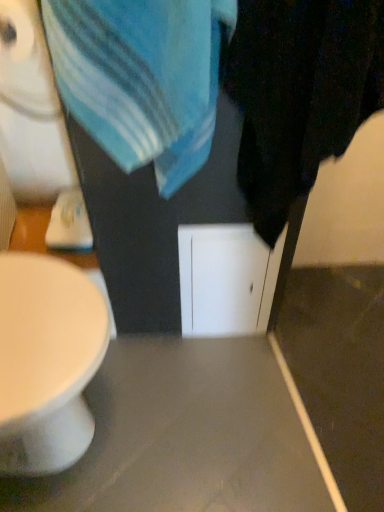
Question: Considering the relative sizes of white paper at upper left and matte gray table at center in the image provided, is white paper at upper left smaller than matte gray table at center?

Choices:
 (A) no
 (B) yes

Answer: (B)

Question: Is white paper at upper left completely or partially outside of matte gray table at center?

Choices:
 (A) yes
 (B) no

Answer: (A)

Question: Is white paper at upper left at the left side of matte gray table at center?

Choices:
 (A) yes
 (B) no

Answer: (A)

Question: Is matte gray table at center at the back of white paper at upper left?

Choices:
 (A) no
 (B) yes

Answer: (A)

Question: Considering the relative sizes of white paper at upper left and matte gray table at center in the image provided, is white paper at upper left shorter than matte gray table at center?

Choices:
 (A) no
 (B) yes

Answer: (A)

Question: From the image's perspective, relative to black matte towel at right, is matte gray table at center above or below?

Choices:
 (A) above
 (B) below

Answer: (B)

Question: Considering the positions of point (244, 344) and point (264, 150), is point (244, 344) closer or farther from the camera than point (264, 150)?

Choices:
 (A) closer
 (B) farther

Answer: (B)

Question: Is matte gray table at center situated inside black matte towel at right or outside?

Choices:
 (A) outside
 (B) inside

Answer: (A)

Question: In terms of width, does matte gray table at center look wider or thinner when compared to black matte towel at right?

Choices:
 (A) wide
 (B) thin

Answer: (A)

Question: Considering the positions of point (317, 52) and point (11, 9), is point (317, 52) closer or farther from the camera than point (11, 9)?

Choices:
 (A) closer
 (B) farther

Answer: (A)

Question: Relative to white paper at upper left, is black matte towel at right in front or behind?

Choices:
 (A) front
 (B) behind

Answer: (A)

Question: Visually, is black matte towel at right positioned to the left or to the right of white paper at upper left?

Choices:
 (A) left
 (B) right

Answer: (B)

Question: Is black matte towel at right wider or thinner than white paper at upper left?

Choices:
 (A) thin
 (B) wide

Answer: (B)

Question: Is black matte towel at right spatially inside blue cotton towel at upper center, or outside of it?

Choices:
 (A) inside
 (B) outside

Answer: (B)

Question: Does point (299, 165) appear closer or farther from the camera than point (158, 10)?

Choices:
 (A) farther
 (B) closer

Answer: (A)